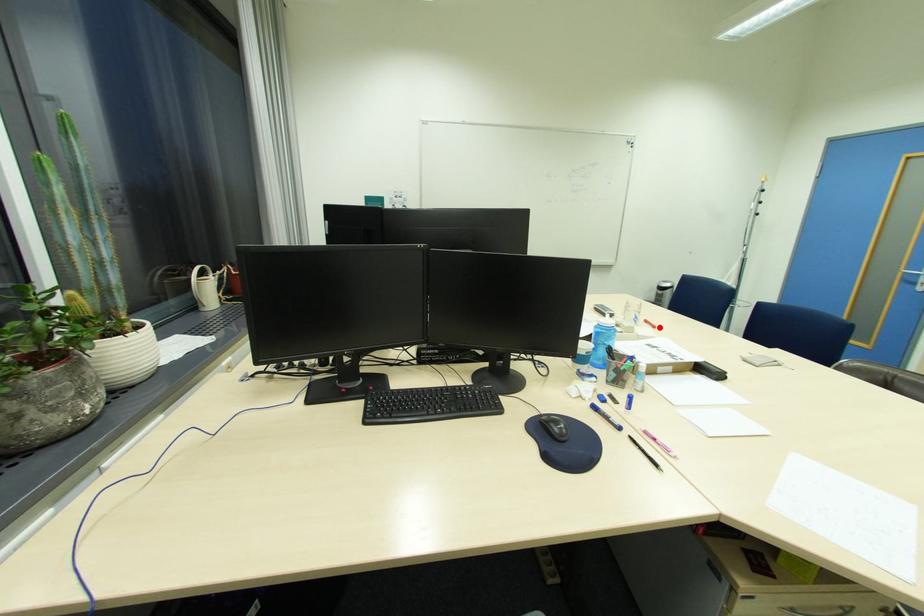
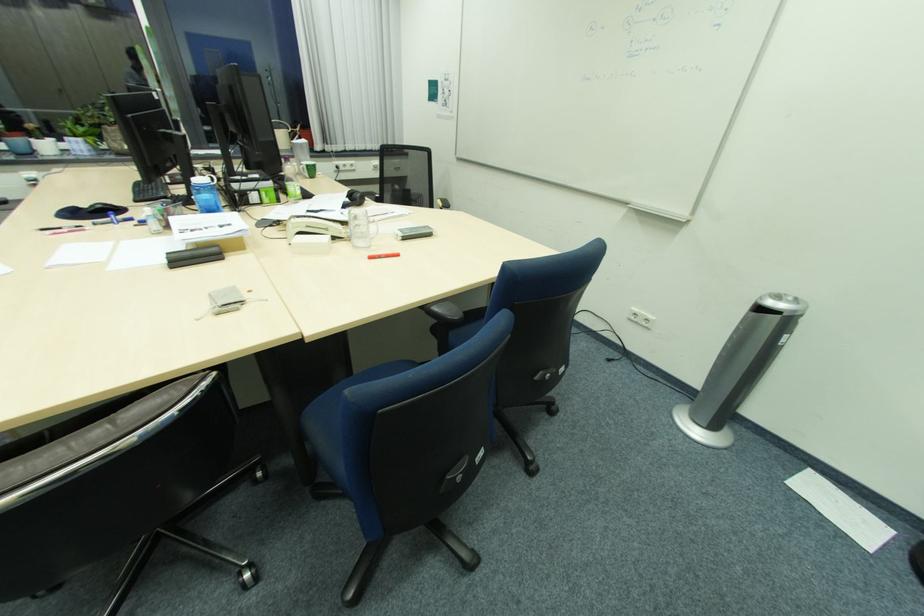
Find the pixel in the second image that matches the highlighted location in the first image.

(377, 257)